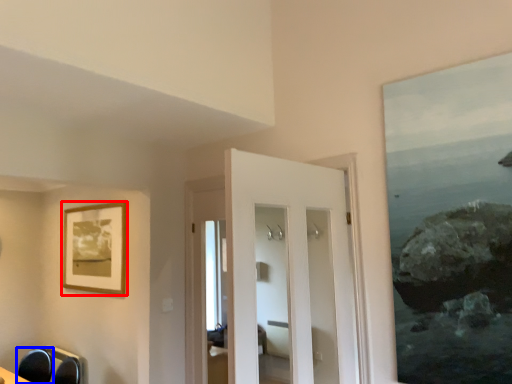
Question: Which point is closer to the camera, picture frame (highlighted by a red box) or swivel chair (highlighted by a blue box)?

Choices:
 (A) picture frame
 (B) swivel chair

Answer: (B)